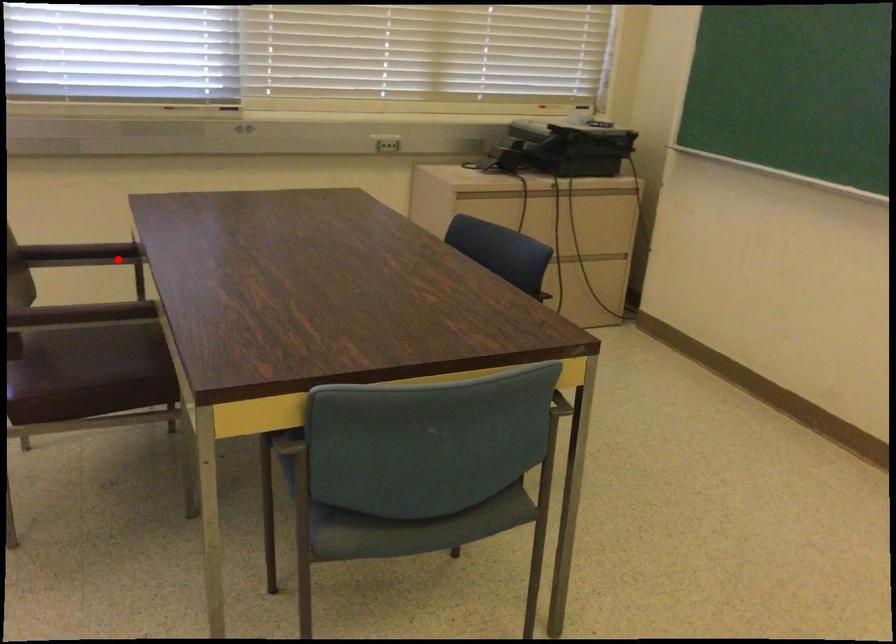
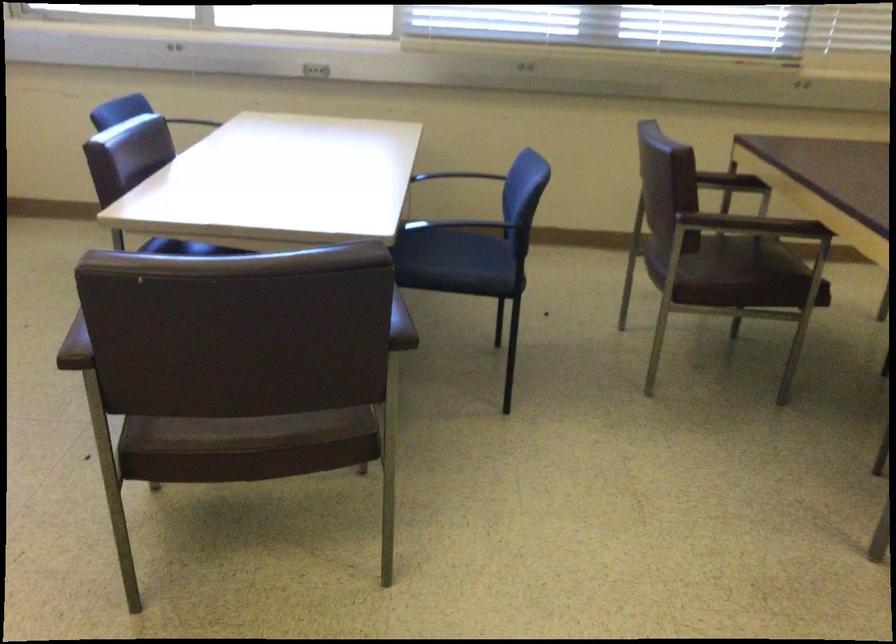
Question: I am providing you with two images of the same scene from different viewpoints. In image1, a red point is highlighted. Considering the same 3D point in image2, which of the following is correct?

Choices:
 (A) It is closer
 (B) It is farther

Answer: (B)